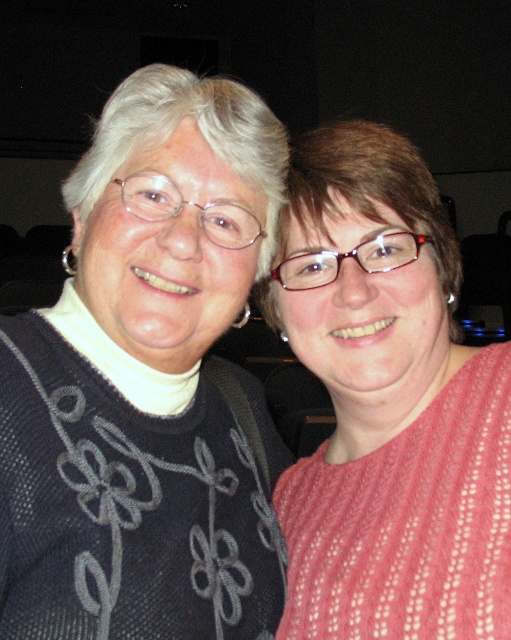
Is point (245, 138) positioned in front of point (371, 348)?

Yes.

At what (x,y) coordinates should I click in order to perform the action: click on dark gray knit sweater at left. Please return your answer as a coordinate pair (x, y). Looking at the image, I should click on (145, 381).

This screenshot has height=640, width=511. Find the location of `dark gray knit sweater at left`. dark gray knit sweater at left is located at coordinates pyautogui.click(x=145, y=381).